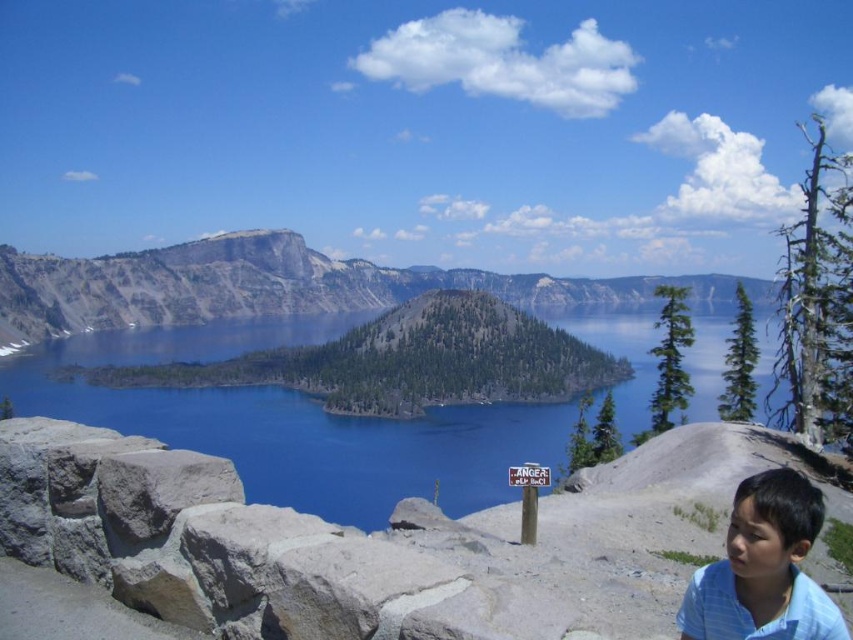
Is gray rock formation at center smaller than blue striped shirt at lower right?

Incorrect, gray rock formation at center is not smaller in size than blue striped shirt at lower right.

Who is taller, gray rock formation at center or blue striped shirt at lower right?

gray rock formation at center

Between point (129, 253) and point (683, 618), which one is positioned behind?

Point (129, 253)

Where is `gray rock formation at center`? This screenshot has width=853, height=640. gray rock formation at center is located at coordinates pyautogui.click(x=270, y=285).